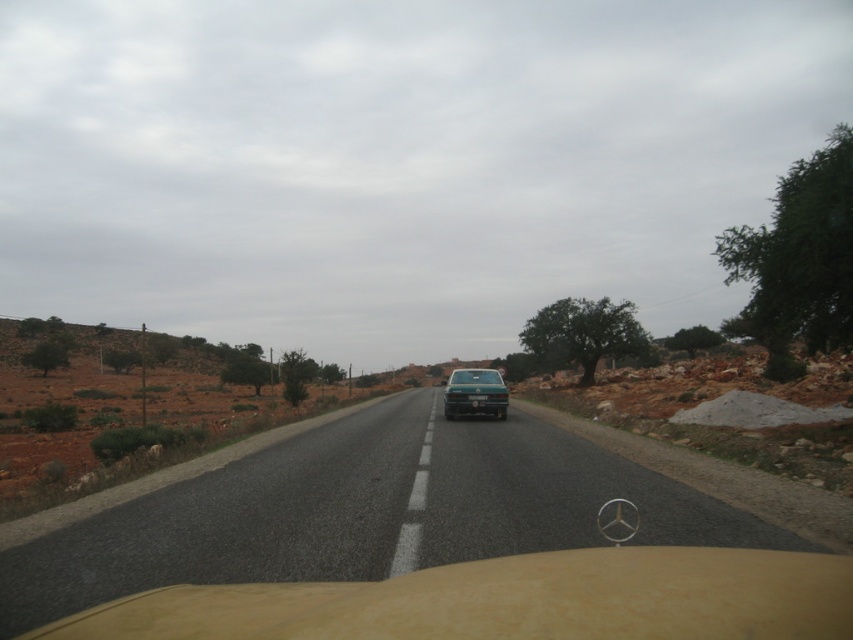
You are driving a green matte car at center and want to make a U turn on the asphalt road at center. Is the road wide enough for your car to turn around without crossing the center dashed line?

The asphalt road at center might be wider than green matte car at center, so there is a possibility that the road is wide enough for the car to turn around without crossing the center dashed line. However, since the exact width difference is uncertain, it is advisable to proceed with caution and ensure there is sufficient space before attempting the maneuver.

You are driving a car that is 4.5 meters long and need to stop completely. You see the asphalt road at center and the green matte car at center in front of you. Can your car fit entirely between them without overlapping either?

The asphalt road at center and green matte car at center are 8.29 meters apart from each other. Since your car is 4.5 meters long, there is enough space between them to fit your car without overlapping either.

From the picture: You are driving a green matte car at center and want to stay on the asphalt road at center. Which direction should you steer to keep your car on the road?

The asphalt road at center is to the left of the green matte car at center, so you should steer left to keep the car on the road.